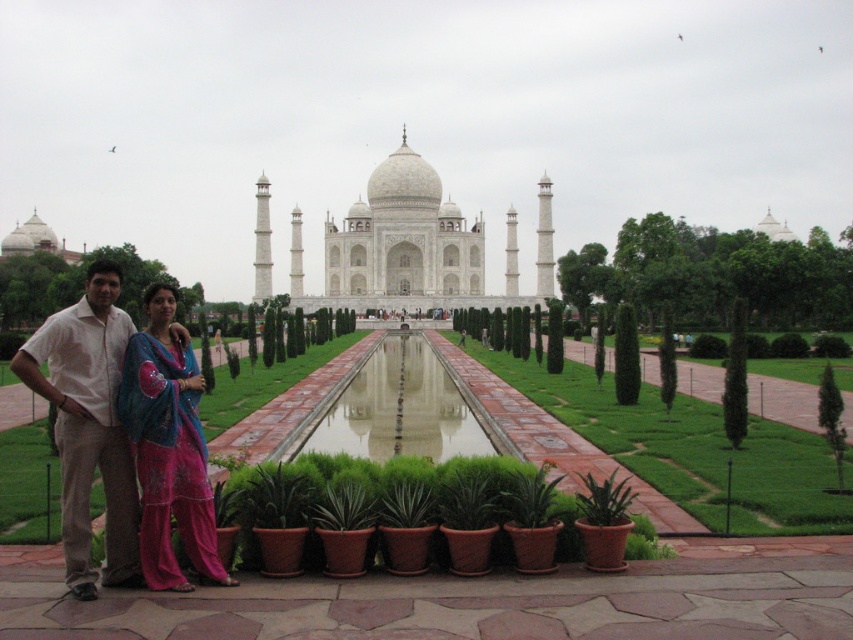
Question: Is light beige cotton shirt at center above shiny blue fabric at center?

Choices:
 (A) yes
 (B) no

Answer: (A)

Question: Can you confirm if green leafy plant at center is positioned below shiny blue fabric at center?

Choices:
 (A) yes
 (B) no

Answer: (A)

Question: From the image, what is the correct spatial relationship of green leafy plant at center in relation to light beige cotton shirt at center?

Choices:
 (A) below
 (B) above

Answer: (A)

Question: Which of the following is the farthest from the observer?

Choices:
 (A) light beige cotton shirt at center
 (B) green leafy plant at center

Answer: (B)

Question: Which object is positioned farthest from the light beige cotton shirt at center?

Choices:
 (A) green leafy plant at center
 (B) shiny blue fabric at center

Answer: (A)

Question: Which point is farther to the camera?

Choices:
 (A) light beige cotton shirt at center
 (B) green leafy plant at center

Answer: (B)